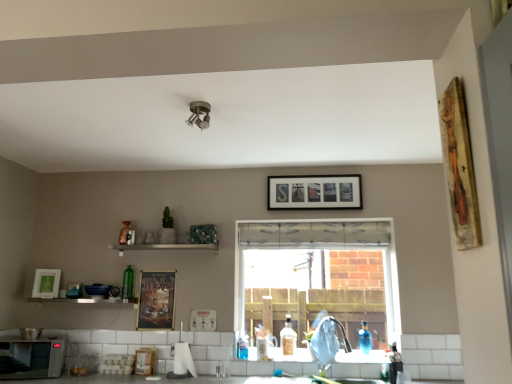
Question: Considering the positions of white matte picture frame at left, placed as the 5th picture frame when sorted from front to back, and metallic silver shelf at lower center in the image, is white matte picture frame at left, placed as the 5th picture frame when sorted from front to back, wider or thinner than metallic silver shelf at lower center?

Choices:
 (A) thin
 (B) wide

Answer: (A)

Question: From the image's perspective, is white matte picture frame at left, the first picture frame in the left-to-right sequence, positioned above or below metallic silver shelf at lower center?

Choices:
 (A) below
 (B) above

Answer: (B)

Question: Considering the real-world distances, which object is farthest from the white fabric window at center?

Choices:
 (A) green glass bottle at shelf, the fourth bottle from the right
 (B) wooden painting at upper right, arranged as the 1th picture frame when viewed from the right
 (C) metallic silver shelf at lower center
 (D) metallic poster at center, the 4th picture frame viewed from the top
 (E) wooden framed letters at upper center, which is the 2th picture frame from right to left

Answer: (B)

Question: Which is farther from the translucent glass bottle at sink, arranged as the 3th bottle when viewed from the front?

Choices:
 (A) wooden painting at upper right, arranged as the 1th picture frame when viewed from the right
 (B) blue glass bottle at lower right, the 2th bottle in the front-to-back sequence
 (C) metallic poster at center, placed as the second picture frame when sorted from bottom to top
 (D) white fabric window at center
 (E) translucent plastic bottle at lower right, the 4th bottle when ordered from left to right

Answer: (A)